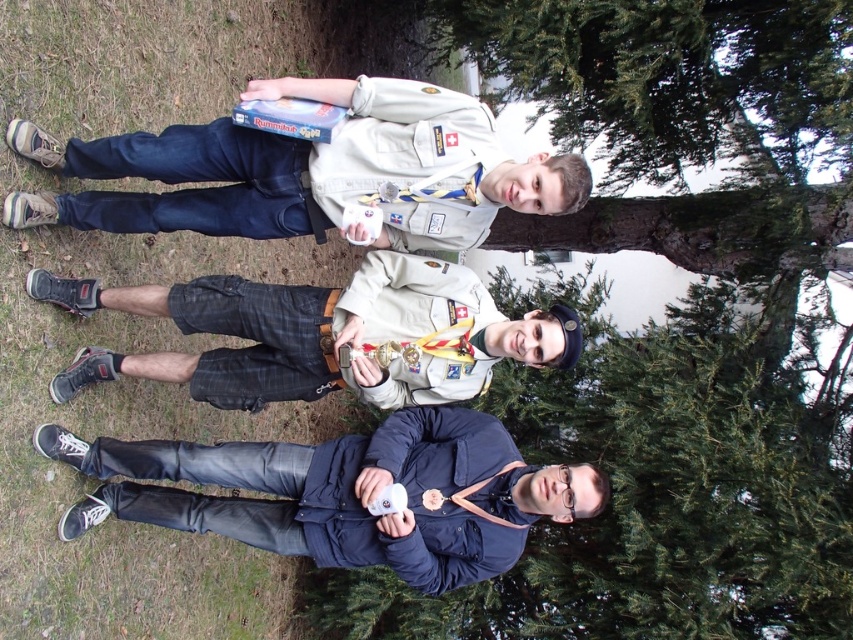
Does point (465, 209) come farther from viewer compared to point (526, 330)?

No, it is not.

Can you confirm if matte khaki uniform at center is positioned above matte black shorts at center?

Indeed, matte khaki uniform at center is positioned over matte black shorts at center.

Find the location of a particular element. matte khaki uniform at center is located at coordinates (309, 170).

Is point (506, 456) positioned in front of point (567, 320)?

No, (506, 456) is further to viewer.

Is point (430, 445) behind point (277, 387)?

Yes, it is.

Where is `dark blue fabric jacket at lower center`? dark blue fabric jacket at lower center is located at coordinates (346, 493).

Is matte khaki uniform at center shorter than dark blue fabric jacket at lower center?

Correct, matte khaki uniform at center is not as tall as dark blue fabric jacket at lower center.

Consider the image. Is matte khaki uniform at center taller than dark blue fabric jacket at lower center?

No.

Image resolution: width=853 pixels, height=640 pixels. Describe the element at coordinates (309, 170) in the screenshot. I see `matte khaki uniform at center` at that location.

You are a GUI agent. You are given a task and a screenshot of the screen. Output one action in this format:
    pyautogui.click(x=<x>, y=<y>)
    Task: Click on the matte khaki uniform at center
    
    Given the screenshot: What is the action you would take?
    pyautogui.click(x=309, y=170)